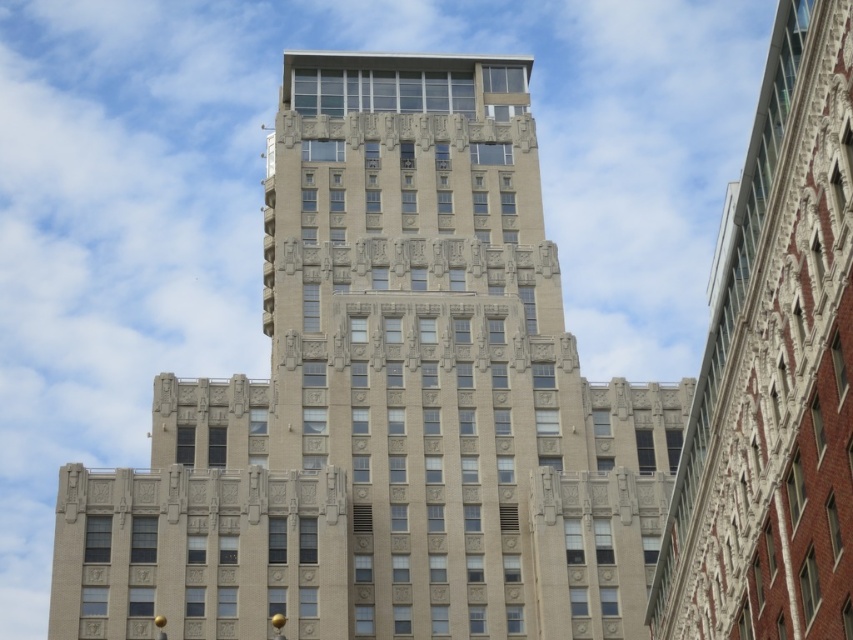
You are standing at the entrance of the beige stone building at center. If you look towards the point marked as coordinates 0.630, 0.455, what will you see?

You will see the beige stone building at center located at point (x=387, y=403).

You are standing in front of the building and notice two points marked on the facade. The first point is at coordinate point (309, 100) and the second is at point (815, 260). Which point is closer to you?

Point (309, 100) is further to the camera than point (815, 260), so the point closer to you is point (815, 260).

You are an architect analyzing the facade of the beige stone building at center and the beige stone building at upper center. Which one appears bigger in size?

The beige stone building at center is larger in size compared to the beige stone building at upper center.